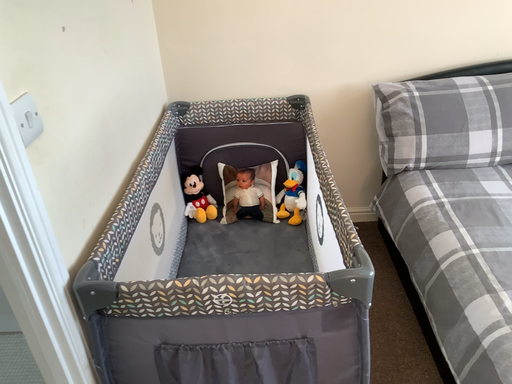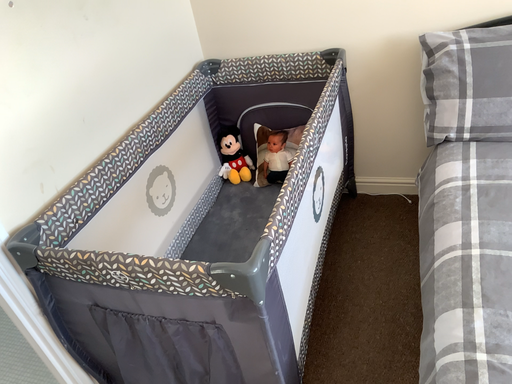
Question: Which way did the camera rotate in the video?

Choices:
 (A) rotated right
 (B) rotated left

Answer: (B)